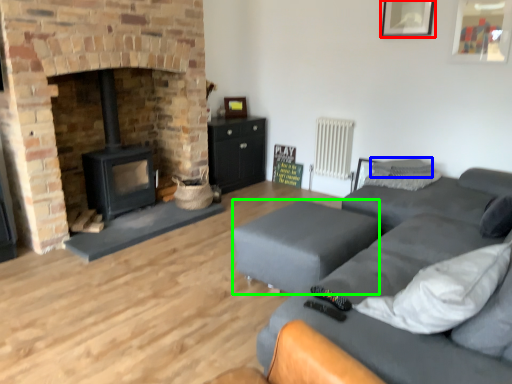
Question: Estimate the real-world distances between objects in this image. Which object is farther from picture frame (highlighted by a red box), pillow (highlighted by a blue box) or flat (highlighted by a green box)?

Choices:
 (A) pillow
 (B) flat

Answer: (B)